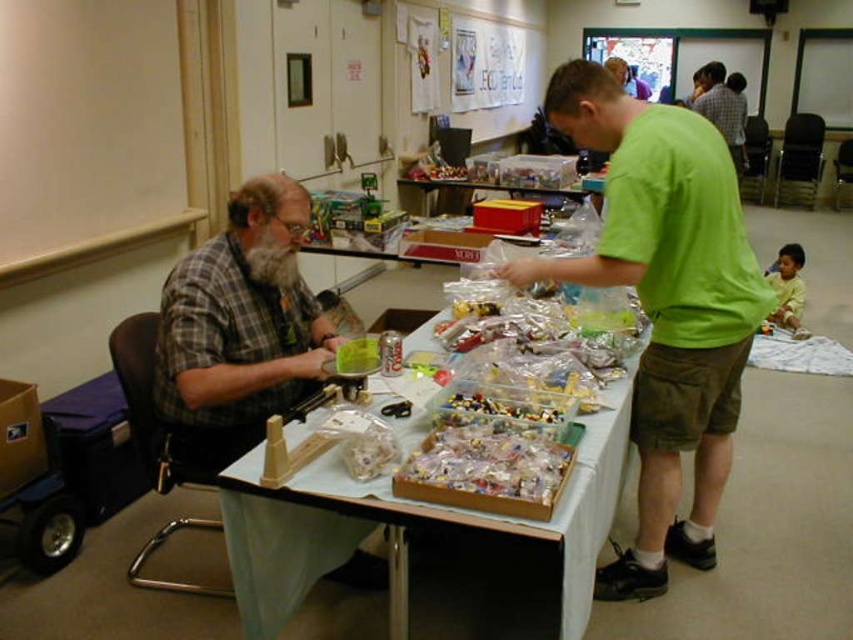
Which is in front, point (140, 225) or point (694, 106)?

Positioned in front is point (140, 225).

This screenshot has width=853, height=640. I want to click on matte white board at upper left, so click(x=99, y=243).

Does plaid shirt at left appear over green matte shirt at upper center?

No.

Identify the location of plaid shirt at left. (241, 326).

Is plaid shirt at left in front of translucent plastic table at center?

That is True.

Does plaid shirt at left appear over translucent plastic table at center?

Actually, plaid shirt at left is below translucent plastic table at center.

Locate an element on the screen. plaid shirt at left is located at coordinates (241, 326).

This screenshot has height=640, width=853. I want to click on plaid shirt at left, so tap(241, 326).